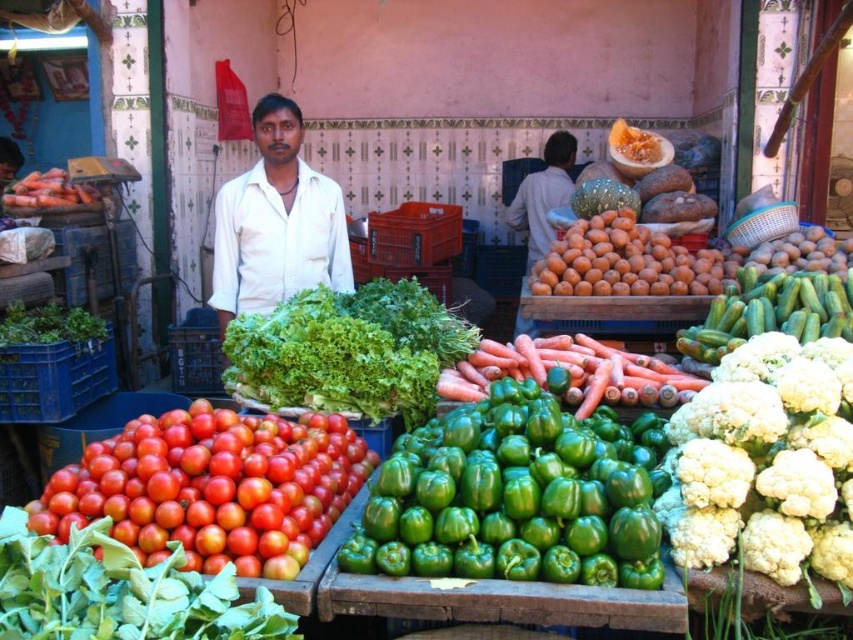
From the picture: Can you confirm if white fluffy cauliflower at right is positioned to the right of red glossy tomatoes at lower left?

Yes, white fluffy cauliflower at right is to the right of red glossy tomatoes at lower left.

Where is `white fluffy cauliflower at right`? white fluffy cauliflower at right is located at coordinates (766, 461).

Is point (24, 568) farther from viewer compared to point (520, 198)?

No, (24, 568) is closer to viewer.

What do you see at coordinates (119, 593) in the screenshot?
I see `red glossy tomatoes at lower left` at bounding box center [119, 593].

Find the location of `red glossy tomatoes at lower left`. red glossy tomatoes at lower left is located at coordinates (119, 593).

Measure the distance from green smooth cucumber at right to green leafy at left.

green smooth cucumber at right and green leafy at left are 3.04 meters apart from each other.

Between point (695, 356) and point (74, 324), which one is positioned behind?

Point (74, 324)

The height and width of the screenshot is (640, 853). I want to click on green smooth cucumber at right, so click(770, 312).

Locate an element on the screen. The image size is (853, 640). green smooth cucumber at right is located at coordinates (770, 312).